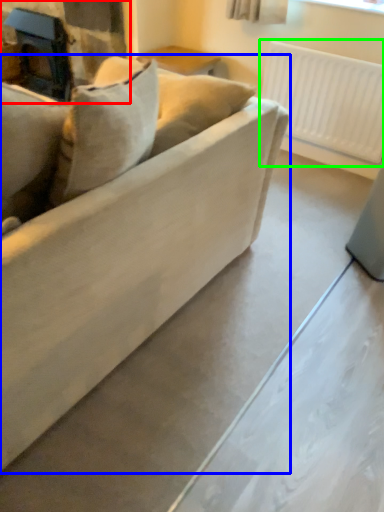
Question: Based on their relative distances, which object is farther from fireplace (highlighted by a red box)? Choose from studio couch (highlighted by a blue box) and radiator (highlighted by a green box).

Choices:
 (A) studio couch
 (B) radiator

Answer: (A)